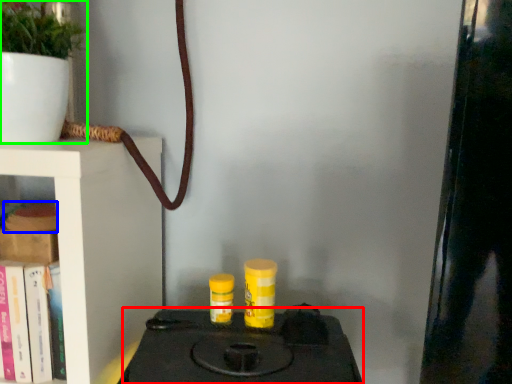
Question: Which object is the closest to the stove (highlighted by a red box)? Choose among these: book (highlighted by a blue box) or houseplant (highlighted by a green box).

Choices:
 (A) book
 (B) houseplant

Answer: (A)